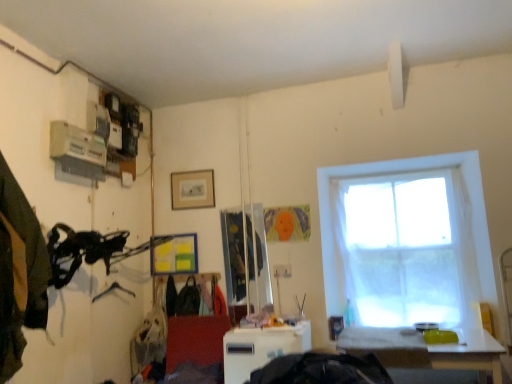
Question: Looking at the image, does metallic silver hanger at lower left seem bigger or smaller compared to black fabric bag at center, which is counted as the 2th clothing, starting from the left?

Choices:
 (A) big
 (B) small

Answer: (B)

Question: Is metallic silver hanger at lower left spatially inside black fabric bag at center, which is counted as the 2th clothing, starting from the left, or outside of it?

Choices:
 (A) outside
 (B) inside

Answer: (A)

Question: Considering the real-world distances, which object is farthest from the white plastic table at center, the second table from the right?

Choices:
 (A) white sheer curtain at right
 (B) matte wood picture frame at upper center
 (C) white glossy table at lower right, which is the second table in left-to-right order
 (D) dark green fabric at left, the 3th clothing positioned from the right
 (E) black fabric bag at center, placed as the 1th clothing when sorted from back to front

Answer: (B)

Question: Which object is the closest to the white plastic table at center, the second table from the right?

Choices:
 (A) matte wood picture frame at upper center
 (B) white glossy table at lower right, which is the second table in left-to-right order
 (C) matte black backpack at center, which appears as the second clothing when viewed from the front
 (D) black fabric bag at center, the second clothing from the right
 (E) metallic silver hanger at lower left

Answer: (B)